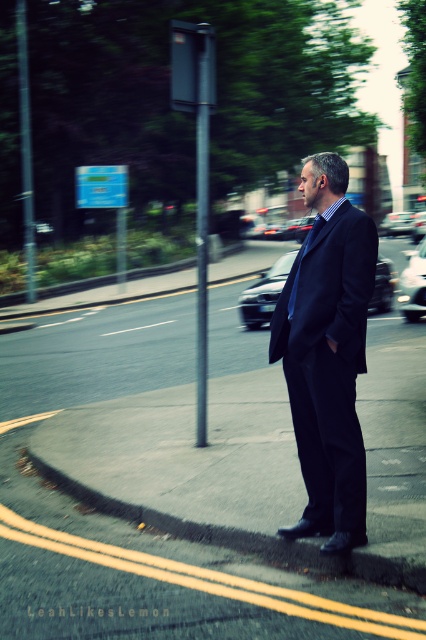
Does concrete at lower right appear on the left side of metallic gray pole at left?

In fact, concrete at lower right is to the right of metallic gray pole at left.

Is concrete at lower right closer to camera compared to metallic gray pole at left?

Yes, it is in front of metallic gray pole at left.

I want to click on concrete at lower right, so click(x=250, y=538).

Is dark blue suit at center to the left of metallic silver sedan at center from the viewer's perspective?

Indeed, dark blue suit at center is positioned on the left side of metallic silver sedan at center.

In the scene shown: Who is taller, dark blue suit at center or metallic silver sedan at center?

metallic silver sedan at center

Who is more forward, (328, 291) or (400, 211)?

Point (328, 291)

At what (x,y) coordinates should I click in order to perform the action: click on dark blue suit at center. Please return your answer as a coordinate pair (x, y). Looking at the image, I should click on (328, 355).

Can you confirm if dark blue suit at center is bigger than metallic silver car at center?

No.

Who is positioned more to the left, dark blue suit at center or metallic silver car at center?

From the viewer's perspective, dark blue suit at center appears more on the left side.

Does point (334, 282) come farther from viewer compared to point (403, 307)?

No, it is in front of (403, 307).

Where is `dark blue suit at center`? dark blue suit at center is located at coordinates (328, 355).